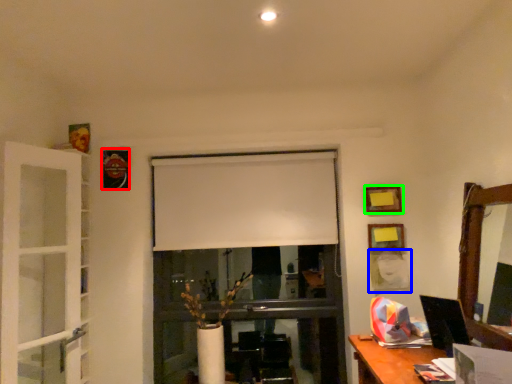
Question: Which is nearer to the picture frame (highlighted by a red box)? picture frame (highlighted by a blue box) or picture frame (highlighted by a green box).

Choices:
 (A) picture frame
 (B) picture frame

Answer: (B)